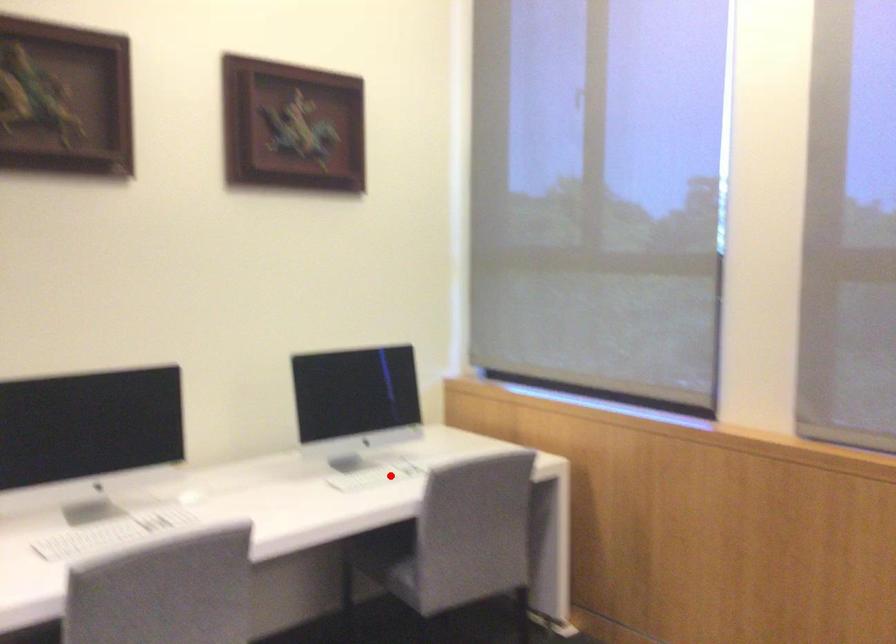
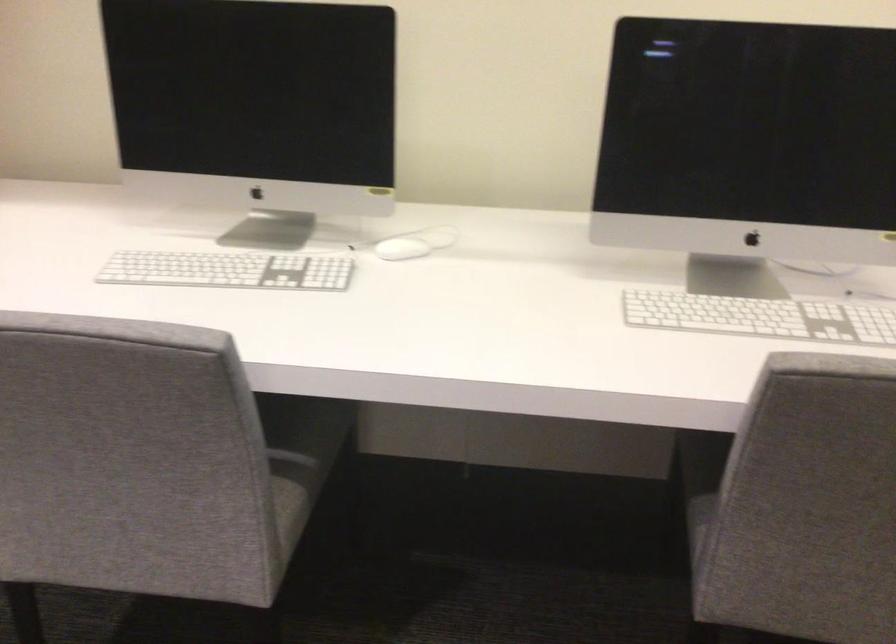
Question: I am providing you with two images of the same scene from different viewpoints. Given a red point in image1, look at the same physical point in image2. Is it:

Choices:
 (A) Closer to the viewpoint
 (B) Farther from the viewpoint

Answer: (A)